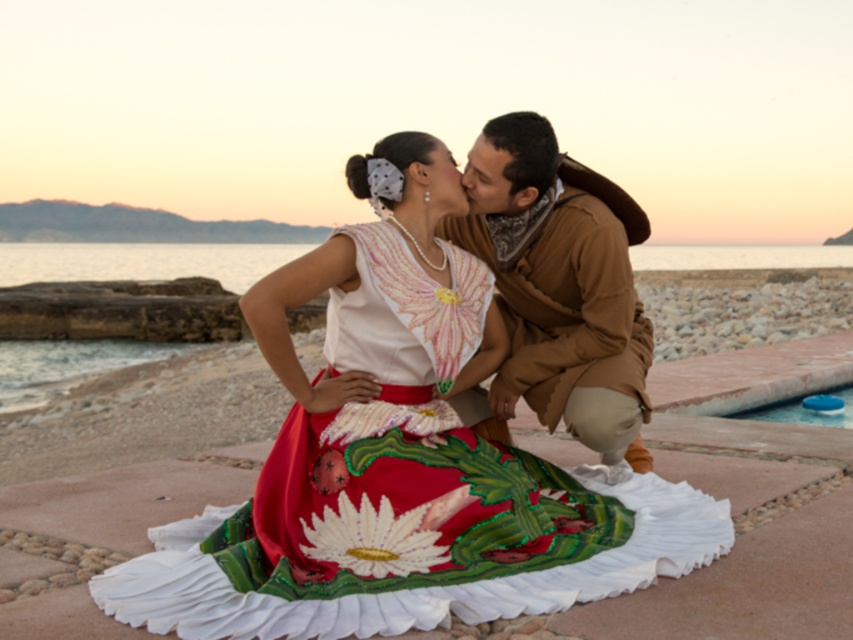
You are a photographer who wants to capture the couple in the image. You notice the blue plastic lid at lower right and the matte brown forehead at upper center are blocking the view. Which object is more to the right and should be moved to the left to clear the shot?

The blue plastic lid at lower right is positioned on the right side of matte brown forehead at upper center, so it is more to the right and should be moved to the left to clear the shot.

What are the coordinates of the brown suede jacket at center?

The coordinates of the brown suede jacket at center are at point [561,289].